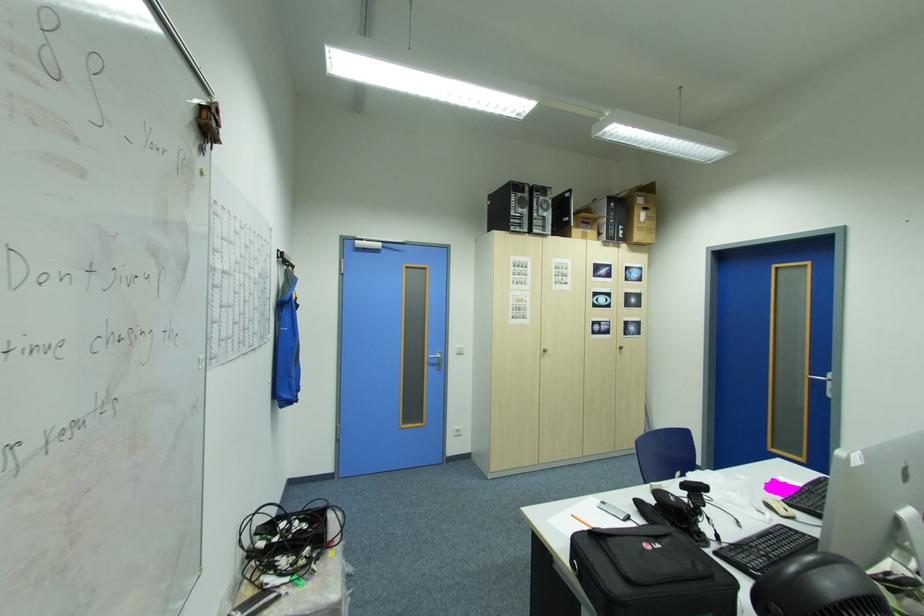
The height and width of the screenshot is (616, 924). Find the location of `pink computer mouse`. pink computer mouse is located at coordinates (781, 485).